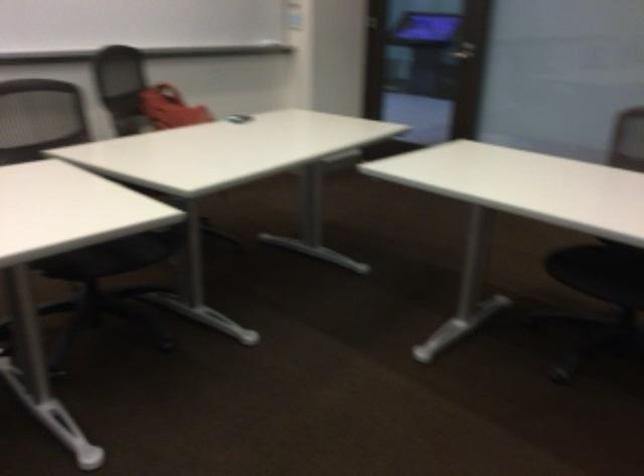
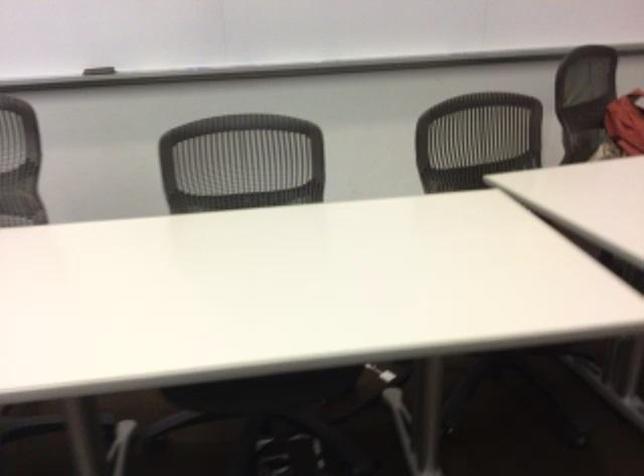
Question: How did the camera likely rotate?

Choices:
 (A) Left
 (B) Right
 (C) Up
 (D) Down

Answer: (A)